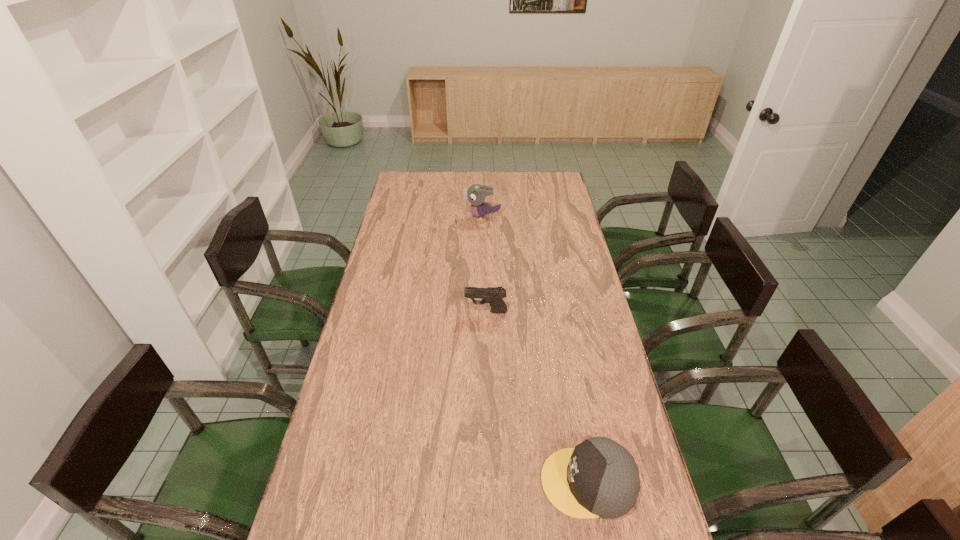
I want to click on vacant point located between the tallest object and the second nearest object, so click(484, 264).

Where is `empty location between the second nearest object and the cap`? The image size is (960, 540). empty location between the second nearest object and the cap is located at coordinates (537, 397).

Locate an element on the screen. This screenshot has width=960, height=540. vacant area that lies between the tallest object and the pistol is located at coordinates (484, 264).

Find the location of `object identified as the second closest to the nearest object`. object identified as the second closest to the nearest object is located at coordinates (476, 194).

Identify which object is the nearest to the nearest object. Please provide its 2D coordinates. Your answer should be formatted as a tuple, i.e. [(x, y)], where the tuple contains the x and y coordinates of a point satisfying the conditions above.

[(494, 295)]